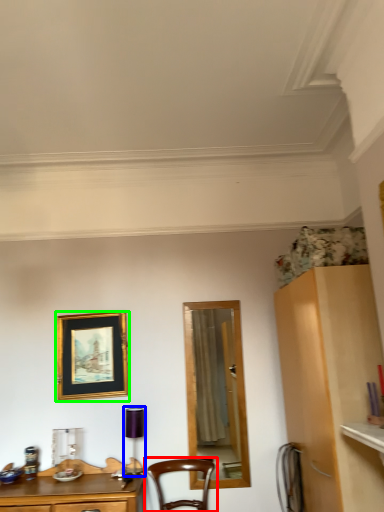
Question: Which object is positioned closest to chair (highlighted by a red box)? Select from lamp (highlighted by a blue box) and picture frame (highlighted by a green box).

Choices:
 (A) lamp
 (B) picture frame

Answer: (A)